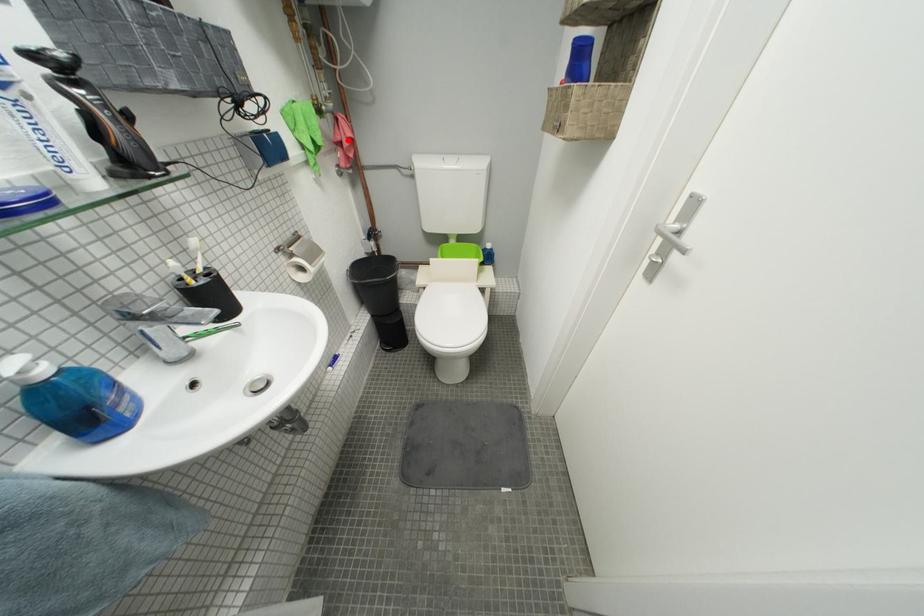
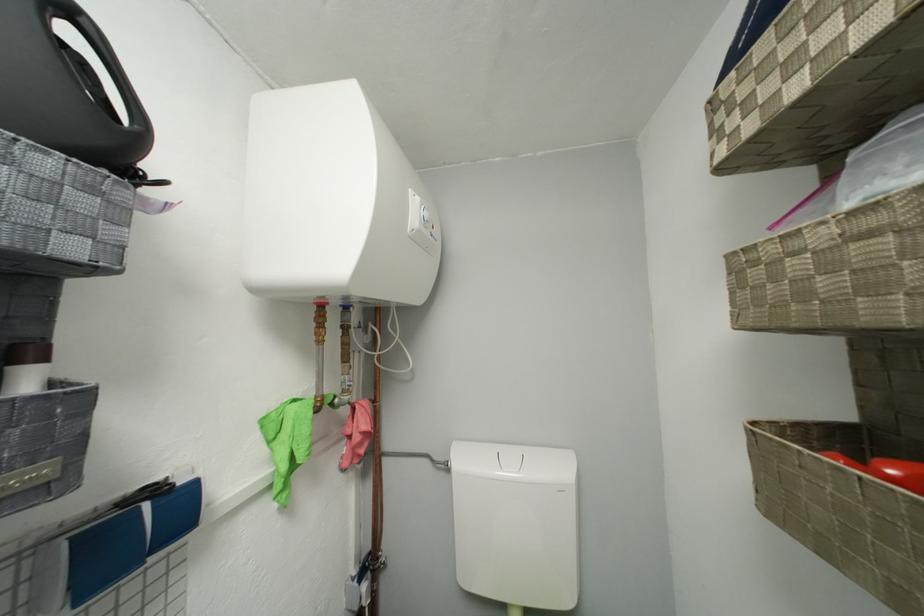
Question: A red point is marked in image1. In image2, is the corresponding 3D point closer to the camera or farther? Reply with the corresponding letter.

Choices:
 (A) The corresponding 3D point is closer.
 (B) The corresponding 3D point is farther.

Answer: (B)